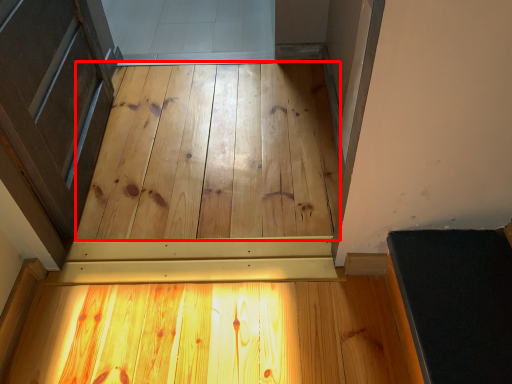
Question: From the image's perspective, what is the correct spatial relationship of plywood (annotated by the red box) in relation to plywood?

Choices:
 (A) below
 (B) above

Answer: (B)